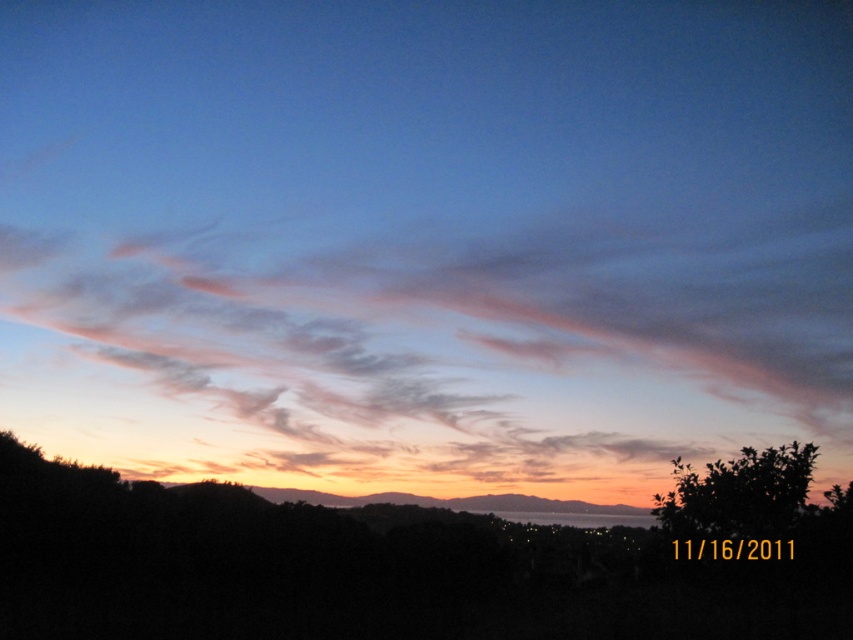
Who is taller, pink translucent clouds at upper center or green leafy tree at lower right?

pink translucent clouds at upper center

Measure the distance from pink translucent clouds at upper center to green leafy tree at lower right.

A distance of 7.78 meters exists between pink translucent clouds at upper center and green leafy tree at lower right.

Is point (277, 458) farther from viewer compared to point (773, 548)?

That is True.

Where is `pink translucent clouds at upper center`? This screenshot has height=640, width=853. pink translucent clouds at upper center is located at coordinates (438, 356).